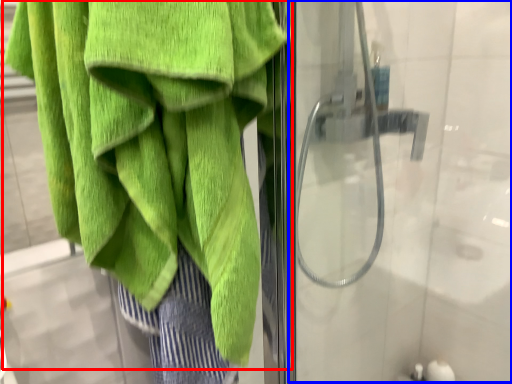
Question: Which point is further to the camera, towel (highlighted by a red box) or screen door (highlighted by a blue box)?

Choices:
 (A) towel
 (B) screen door

Answer: (B)